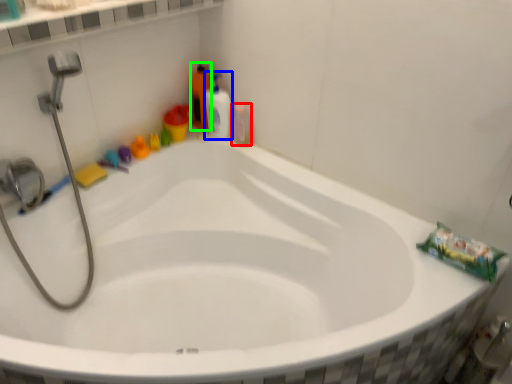
Question: Estimate the real-world distances between objects in this image. Which object is closer to mouthwash (highlighted by a red box), cleaning product (highlighted by a blue box) or cleaning product (highlighted by a green box)?

Choices:
 (A) cleaning product
 (B) cleaning product

Answer: (A)